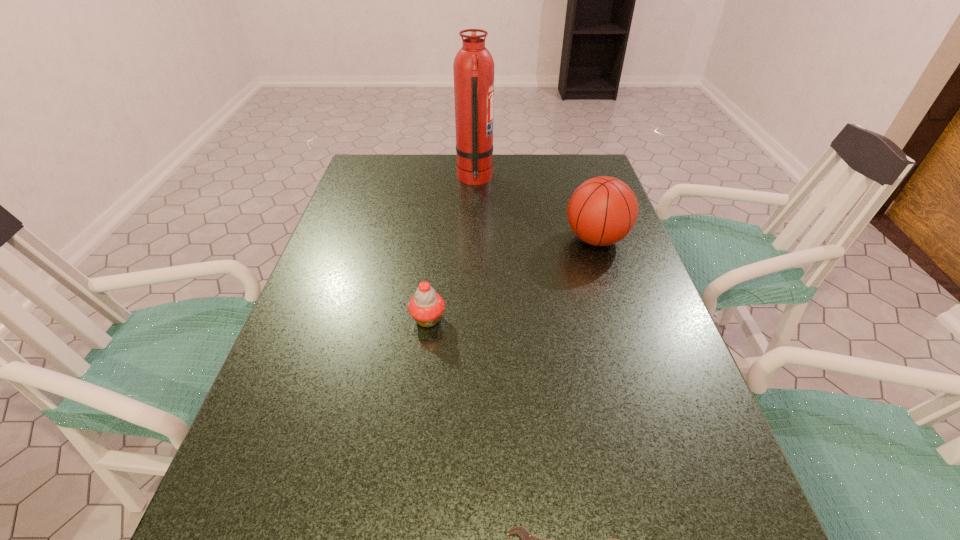
Image resolution: width=960 pixels, height=540 pixels. Find the location of `fire extinguisher`. fire extinguisher is located at coordinates (473, 67).

This screenshot has height=540, width=960. I want to click on the farthest object, so click(x=473, y=67).

Where is `the second farthest object`? the second farthest object is located at coordinates (602, 211).

What are the coordinates of `the rightmost object` in the screenshot? It's located at (602, 211).

You are a GUI agent. You are given a task and a screenshot of the screen. Output one action in this format:
    pyautogui.click(x=<x>, y=<y>)
    Task: Click on the third farthest object
    This screenshot has width=960, height=540.
    Given the screenshot: What is the action you would take?
    pyautogui.click(x=426, y=307)

Find the location of a particular element. The height and width of the screenshot is (540, 960). cupcake is located at coordinates (426, 307).

You are a GUI agent. You are given a task and a screenshot of the screen. Output one action in this format:
    pyautogui.click(x=<x>, y=<y>)
    Task: Click on the vacant position located on the label side of the fire extinguisher
    
    Given the screenshot: What is the action you would take?
    pyautogui.click(x=551, y=178)

Where is `vacant region located on the front of the second farthest object`? vacant region located on the front of the second farthest object is located at coordinates (619, 310).

Identify the location of free space located 0.370m on the front of the cupcake. (405, 515).

Find the location of a particular element. This screenshot has width=960, height=540. object located in the far edge section of the desktop is located at coordinates point(473,67).